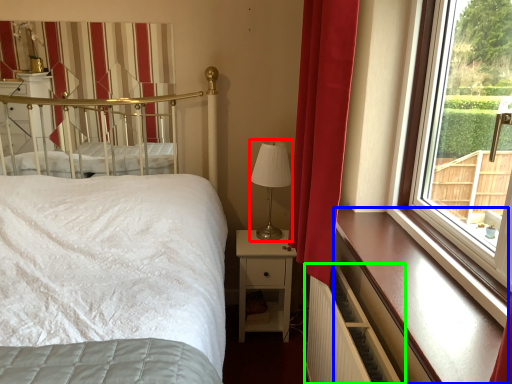
Question: Which is farther away from table lamp (highlighted by a red box)? ledge (highlighted by a blue box) or balustrade (highlighted by a green box)?

Choices:
 (A) ledge
 (B) balustrade

Answer: (A)